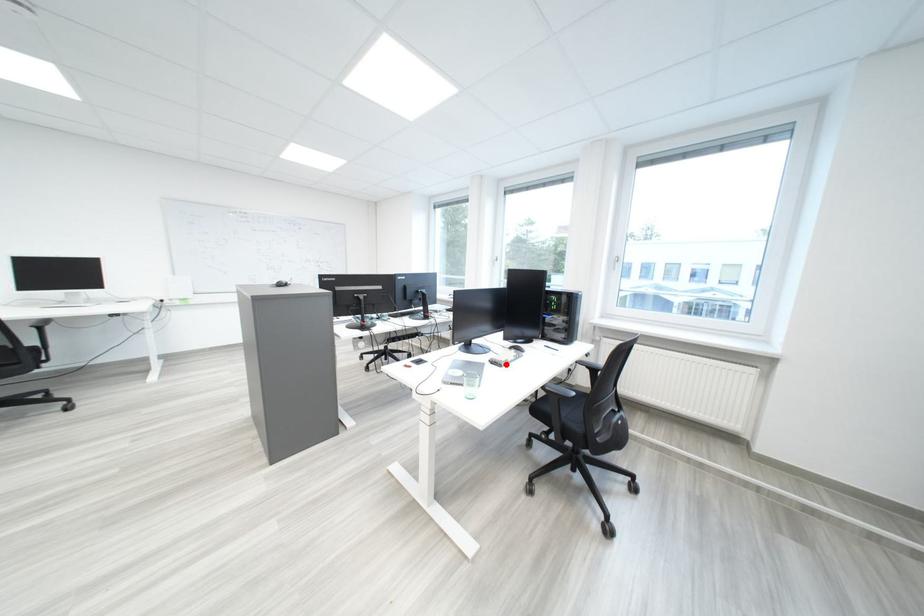
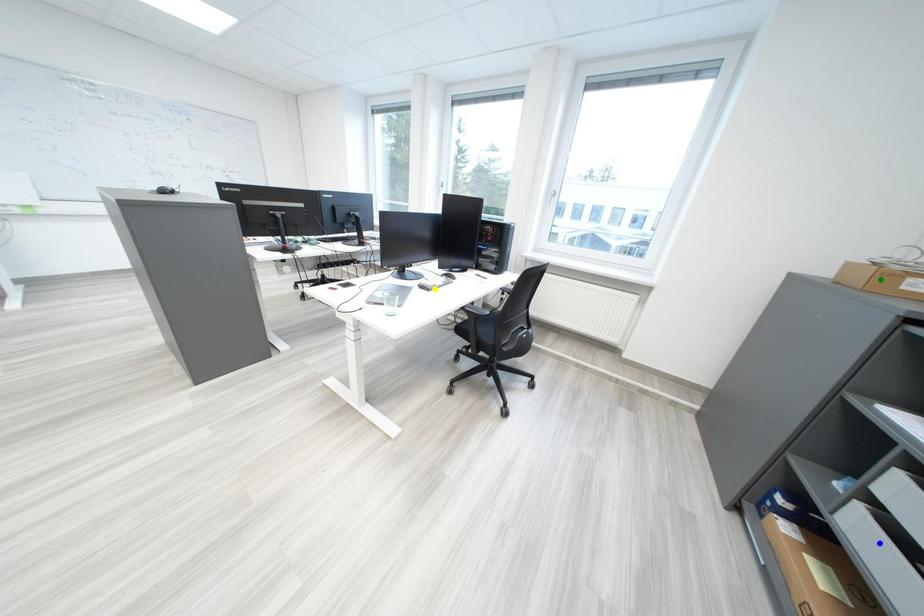
Question: I am providing you with two images of the same scene from different viewpoints. A red point is marked on the first image. You are given multiple points on the second image. Which spot in image 2 lines up with the point in image 1?

Choices:
 (A) yellow point
 (B) green point
 (C) blue point

Answer: (A)